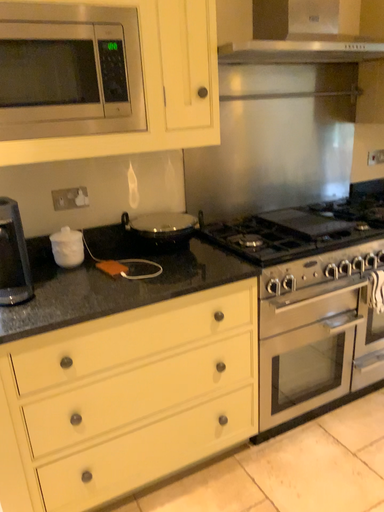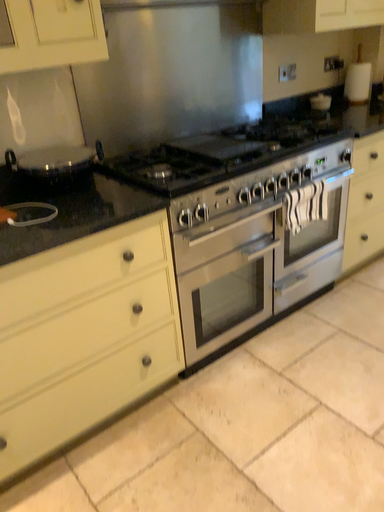
Question: How did the camera likely rotate when shooting the video?

Choices:
 (A) rotated downward
 (B) rotated upward

Answer: (A)